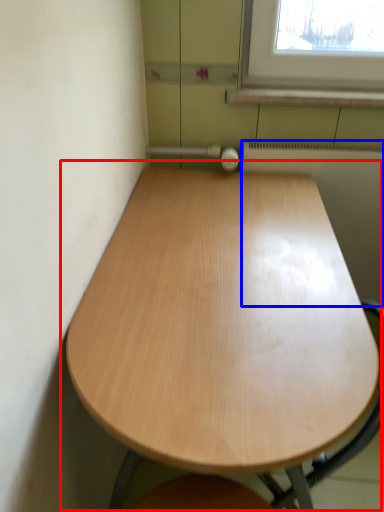
Question: Which object is further to the camera taking this photo, table (highlighted by a red box) or radiator (highlighted by a blue box)?

Choices:
 (A) table
 (B) radiator

Answer: (B)